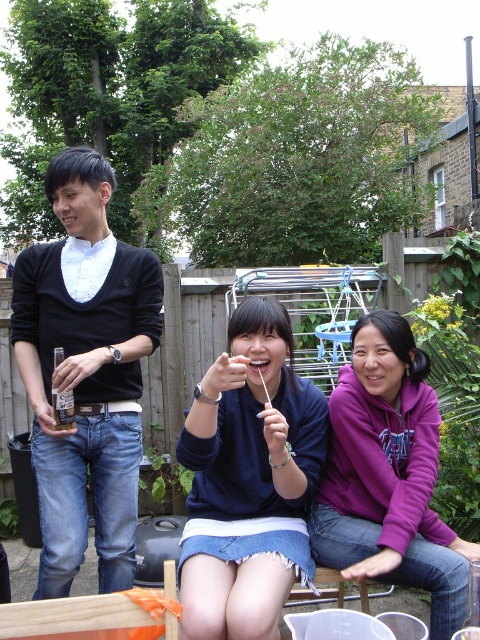
Can you confirm if black sweater at left is thinner than purple fleece at center?

Yes.

Which of these two, black sweater at left or purple fleece at center, stands shorter?

purple fleece at center is shorter.

Is point (119, 579) in front of point (352, 477)?

No, (119, 579) is behind (352, 477).

You are a GUI agent. You are given a task and a screenshot of the screen. Output one action in this format:
    pyautogui.click(x=<x>, y=<y>)
    Task: Click on the black sweater at left
    This screenshot has width=480, height=640.
    Given the screenshot: What is the action you would take?
    pyautogui.click(x=85, y=372)

Between point (52, 417) and point (247, 401), which one is positioned behind?

Point (52, 417)

Which is in front, point (37, 467) or point (256, 493)?

Point (256, 493)

Locate an element on the screen. The width and height of the screenshot is (480, 640). black sweater at left is located at coordinates (85, 372).

What are the coordinates of `black sweater at left` in the screenshot? It's located at (85, 372).

Does dark blue sweater at center appear on the right side of purple fleece at center?

Incorrect, dark blue sweater at center is not on the right side of purple fleece at center.

What do you see at coordinates (249, 481) in the screenshot?
I see `dark blue sweater at center` at bounding box center [249, 481].

Which is in front, point (303, 522) or point (382, 449)?

Positioned in front is point (303, 522).

Locate an element on the screen. This screenshot has height=640, width=480. dark blue sweater at center is located at coordinates (249, 481).